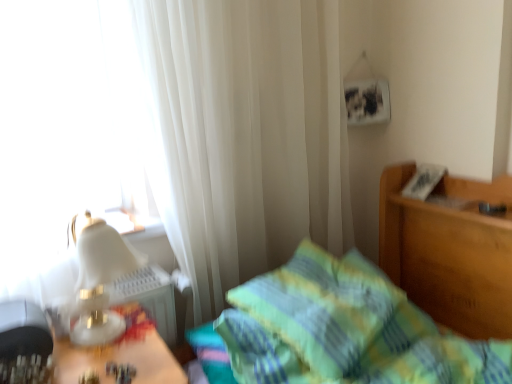
Question: From a real-world perspective, is green plaid bedspread at center on green plaid pillow at center?

Choices:
 (A) no
 (B) yes

Answer: (B)

Question: From a real-world perspective, is green plaid bedspread at center positioned under green plaid pillow at center based on gravity?

Choices:
 (A) yes
 (B) no

Answer: (B)

Question: Considering the relative sizes of green plaid bedspread at center and green plaid pillow at center in the image provided, is green plaid bedspread at center shorter than green plaid pillow at center?

Choices:
 (A) yes
 (B) no

Answer: (B)

Question: Is green plaid bedspread at center to the left of green plaid pillow at center from the viewer's perspective?

Choices:
 (A) no
 (B) yes

Answer: (A)

Question: Can you confirm if green plaid bedspread at center is wider than green plaid pillow at center?

Choices:
 (A) no
 (B) yes

Answer: (B)

Question: Considering the positions of point (489, 183) and point (98, 259), is point (489, 183) closer or farther from the camera than point (98, 259)?

Choices:
 (A) closer
 (B) farther

Answer: (B)

Question: From the image's perspective, is green plaid bedspread at center above or below white glossy table lamp at left?

Choices:
 (A) below
 (B) above

Answer: (A)

Question: Based on their sizes in the image, would you say green plaid bedspread at center is bigger or smaller than white glossy table lamp at left?

Choices:
 (A) big
 (B) small

Answer: (A)

Question: Is green plaid bedspread at center taller or shorter than white glossy table lamp at left?

Choices:
 (A) tall
 (B) short

Answer: (A)

Question: Do you think white sheer curtain at upper left is within white glossy table lamp at left, or outside of it?

Choices:
 (A) outside
 (B) inside

Answer: (A)

Question: Is point (309, 112) positioned closer to the camera than point (105, 337)?

Choices:
 (A) closer
 (B) farther

Answer: (B)

Question: In the image, is white sheer curtain at upper left on the left side or the right side of white glossy table lamp at left?

Choices:
 (A) right
 (B) left

Answer: (A)

Question: Relative to white glossy table lamp at left, is white sheer curtain at upper left in front or behind?

Choices:
 (A) behind
 (B) front

Answer: (A)

Question: From a real-world perspective, is white sheer curtain at upper left physically located above or below green plaid bedspread at center?

Choices:
 (A) below
 (B) above

Answer: (B)

Question: Do you think white sheer curtain at upper left is within green plaid bedspread at center, or outside of it?

Choices:
 (A) outside
 (B) inside

Answer: (A)